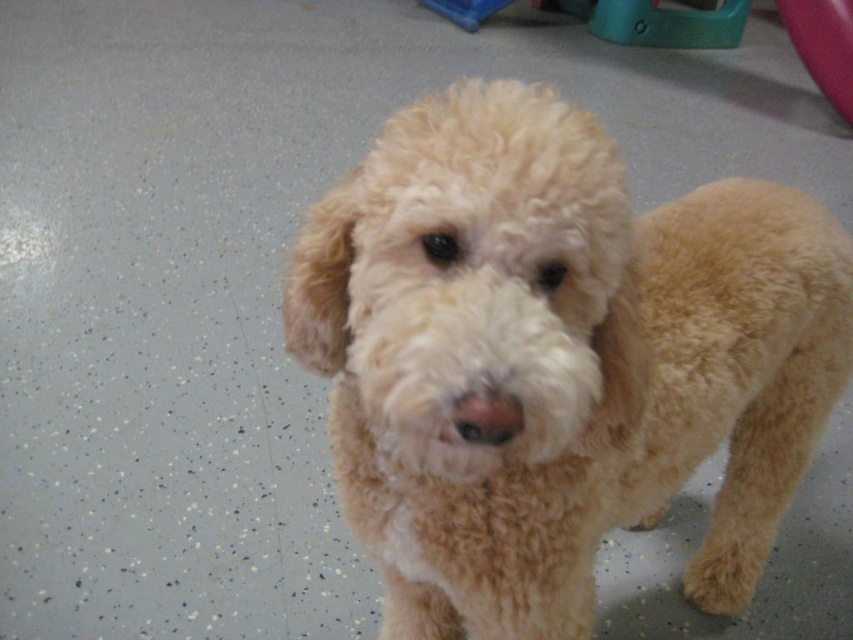
Can you confirm if rubber at upper right is smaller than pink matte/natural nose at center?

No, rubber at upper right is not smaller than pink matte/natural nose at center.

Is rubber at upper right shorter than pink matte/natural nose at center?

No.

Is point (830, 77) closer to camera compared to point (480, 392)?

No, (830, 77) is further to viewer.

Identify the location of rubber at upper right. The image size is (853, 640). (822, 45).

Is fuzzy beige dog at center above pink matte/natural nose at center?

Incorrect, fuzzy beige dog at center is not positioned above pink matte/natural nose at center.

Who is taller, fuzzy beige dog at center or pink matte/natural nose at center?

With more height is fuzzy beige dog at center.

Which is behind, point (433, 244) or point (518, 403)?

The point (433, 244) is behind.

Identify the location of fuzzy beige dog at center. (556, 358).

Does fuzzy beige dog at center lie in front of rubber at upper right?

That is True.

Is fuzzy beige dog at center smaller than rubber at upper right?

Actually, fuzzy beige dog at center might be larger than rubber at upper right.

Is point (740, 520) more distant than point (845, 83)?

No, (740, 520) is closer to viewer.

I want to click on fuzzy beige dog at center, so point(556,358).